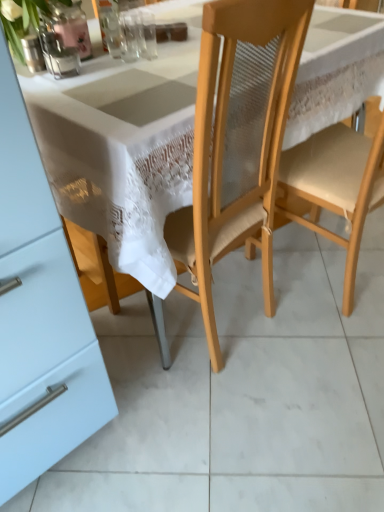
Find the location of `free point in front of wooden chair at center, which ranks as the 2th chair in right-to-left order`. free point in front of wooden chair at center, which ranks as the 2th chair in right-to-left order is located at coordinates (212, 414).